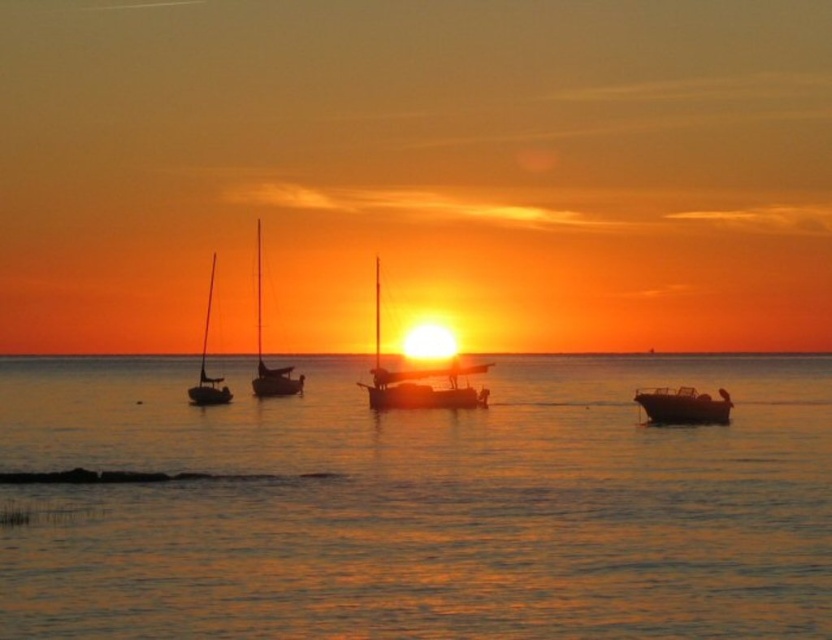
Between metallic silver boat at right and satin black sailboat at left, which one is positioned higher?

satin black sailboat at left is above.

I want to click on metallic silver boat at right, so click(682, 404).

The height and width of the screenshot is (640, 832). What do you see at coordinates (419, 380) in the screenshot?
I see `silvery metallic sailboat at center` at bounding box center [419, 380].

The image size is (832, 640). What do you see at coordinates (419, 380) in the screenshot?
I see `silvery metallic sailboat at center` at bounding box center [419, 380].

Locate an element on the screen. silvery metallic sailboat at center is located at coordinates (419, 380).

Is metallic silver boat at right bigger than satin black sailboat at center?

Incorrect, metallic silver boat at right is not larger than satin black sailboat at center.

Between point (707, 396) and point (260, 369), which one is positioned in front?

Point (707, 396) is in front.

Measure the distance between point [669,394] and camera.

Point [669,394] and camera are 47.75 meters apart from each other.

Where is `metallic silver boat at right`? The height and width of the screenshot is (640, 832). metallic silver boat at right is located at coordinates (682, 404).